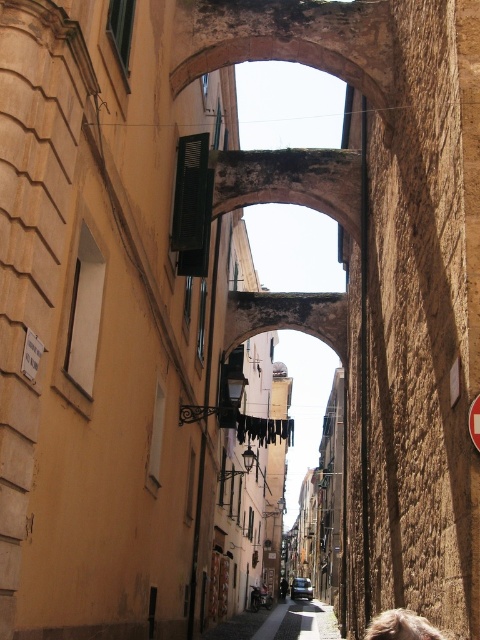
Question: Can you confirm if black fabric laundry at center is wider than dark brown leather jacket at center?

Choices:
 (A) no
 (B) yes

Answer: (B)

Question: Which point is closer to the camera?

Choices:
 (A) blonde hair at lower right
 (B) smooth stone alley at center
 (C) black fabric laundry at center

Answer: (A)

Question: Which object appears farthest from the camera in this image?

Choices:
 (A) dark brown leather jacket at center
 (B) smooth stone alley at center
 (C) black fabric laundry at center
 (D) blonde hair at lower right

Answer: (A)

Question: Which object appears closest to the camera in this image?

Choices:
 (A) smooth stone alley at center
 (B) dark brown leather jacket at center

Answer: (A)

Question: Is blonde hair at lower right to the right of dark brown leather jacket at center from the viewer's perspective?

Choices:
 (A) yes
 (B) no

Answer: (B)

Question: Does blonde hair at lower right appear on the right side of dark brown leather jacket at center?

Choices:
 (A) no
 (B) yes

Answer: (A)